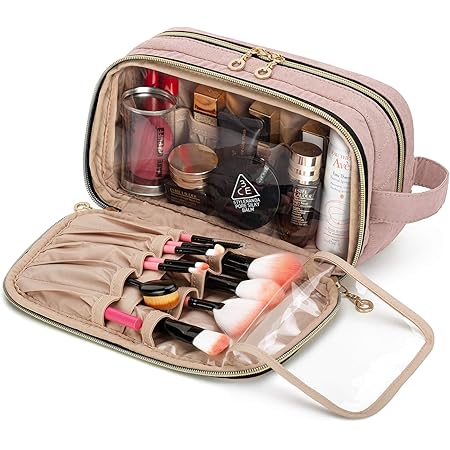
Locate an element on the screen. makeup brushes is located at coordinates (210, 344), (237, 311), (256, 284), (271, 266).